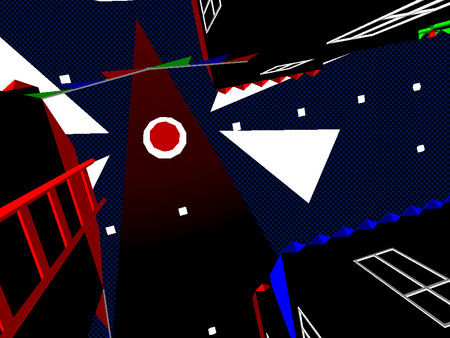
Locate an element on the screen. The image size is (450, 338). white windows is located at coordinates (396, 19), (272, 71), (206, 24), (425, 286), (304, 330).